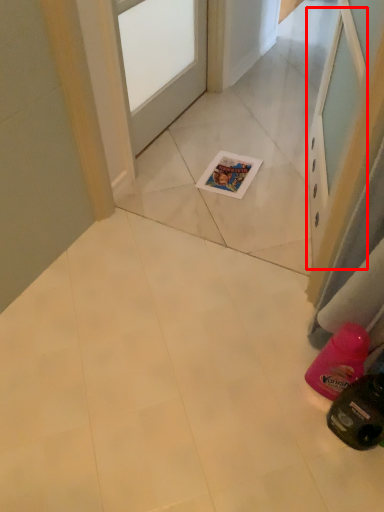
Question: Where is screen door (annotated by the red box) located in relation to door in the image?

Choices:
 (A) left
 (B) right

Answer: (B)